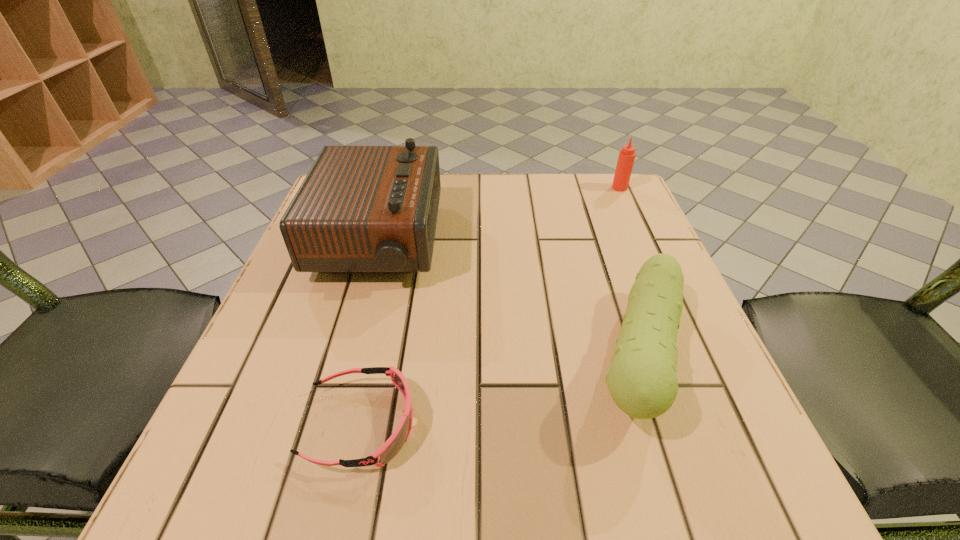
This screenshot has height=540, width=960. I want to click on vacant space that's between the cucumber and the farthest object, so click(630, 272).

Locate an element on the screen. vacant area between the radio receiver and the cucumber is located at coordinates (509, 299).

Where is `empty space between the Tabasco sauce and the shortest object`? empty space between the Tabasco sauce and the shortest object is located at coordinates (491, 306).

Locate an element on the screen. The height and width of the screenshot is (540, 960). free space between the tallest object and the goggles is located at coordinates (370, 333).

Select which object appears as the second closest to the cucumber. Please provide its 2D coordinates. Your answer should be formatted as a tuple, i.e. [(x, y)], where the tuple contains the x and y coordinates of a point satisfying the conditions above.

[(393, 445)]

This screenshot has height=540, width=960. Find the location of `the closest object to the cucumber`. the closest object to the cucumber is located at coordinates (361, 209).

Find the location of `vacant area in the image that satisfies the following two spatial constraints: 1. on the front panel of the cucumber; 2. on the right side of the tallest object`. vacant area in the image that satisfies the following two spatial constraints: 1. on the front panel of the cucumber; 2. on the right side of the tallest object is located at coordinates (346, 356).

The height and width of the screenshot is (540, 960). I want to click on blank space that satisfies the following two spatial constraints: 1. on the front panel of the tallest object; 2. on the back side of the cucumber, so click(x=346, y=356).

In order to click on free spot that satisfies the following two spatial constraints: 1. on the front side of the farthest object; 2. on the front panel of the tallest object in this screenshot , I will do `click(644, 241)`.

Identify the location of free space that satisfies the following two spatial constraints: 1. on the front panel of the radio receiver; 2. on the back side of the cucumber. (346, 356).